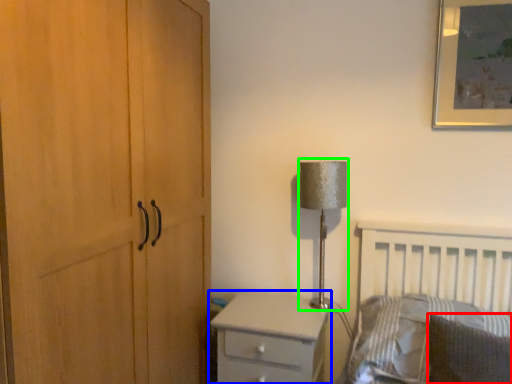
Question: Which object is the closest to the pillow (highlighted by a red box)? Choose among these: chest of drawers (highlighted by a blue box) or table lamp (highlighted by a green box).

Choices:
 (A) chest of drawers
 (B) table lamp

Answer: (A)